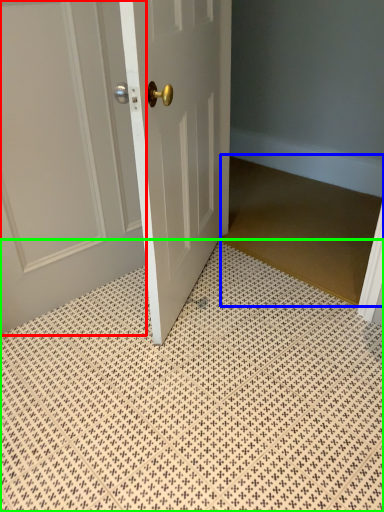
Question: Which is farther away from door (highlighted by a red box)? doormat (highlighted by a blue box) or bath mat (highlighted by a green box)?

Choices:
 (A) doormat
 (B) bath mat

Answer: (A)